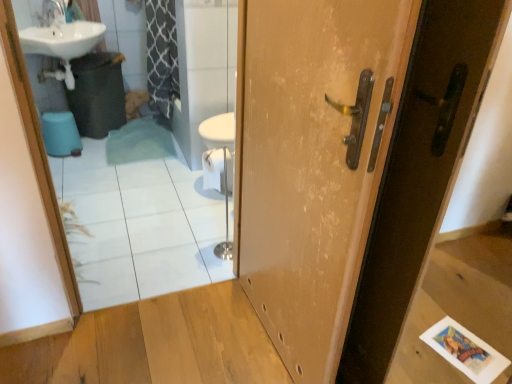
Question: Is there a large distance between blue plastic toilet bowl at lower left and white glossy mirror at upper left?

Choices:
 (A) yes
 (B) no

Answer: (B)

Question: Would you say white glossy mirror at upper left is part of blue plastic toilet bowl at lower left's contents?

Choices:
 (A) no
 (B) yes

Answer: (A)

Question: Does blue plastic toilet bowl at lower left have a greater width compared to white glossy mirror at upper left?

Choices:
 (A) no
 (B) yes

Answer: (B)

Question: Is blue plastic toilet bowl at lower left smaller than white glossy mirror at upper left?

Choices:
 (A) yes
 (B) no

Answer: (A)

Question: From the image's perspective, is blue plastic toilet bowl at lower left on white glossy mirror at upper left?

Choices:
 (A) no
 (B) yes

Answer: (B)

Question: Is blue plastic toilet bowl at lower left behind white glossy mirror at upper left?

Choices:
 (A) yes
 (B) no

Answer: (A)

Question: Considering the relative positions of white glossy mirror at upper left and blue plastic toilet bowl at lower left in the image provided, is white glossy mirror at upper left to the left of blue plastic toilet bowl at lower left from the viewer's perspective?

Choices:
 (A) no
 (B) yes

Answer: (A)

Question: Considering the relative sizes of white glossy mirror at upper left and blue plastic toilet bowl at lower left in the image provided, is white glossy mirror at upper left smaller than blue plastic toilet bowl at lower left?

Choices:
 (A) no
 (B) yes

Answer: (A)

Question: Can you confirm if white glossy mirror at upper left is bigger than blue plastic toilet bowl at lower left?

Choices:
 (A) no
 (B) yes

Answer: (B)

Question: Can you confirm if white glossy mirror at upper left is shorter than blue plastic toilet bowl at lower left?

Choices:
 (A) no
 (B) yes

Answer: (A)

Question: Considering the relative sizes of white glossy mirror at upper left and blue plastic toilet bowl at lower left in the image provided, is white glossy mirror at upper left taller than blue plastic toilet bowl at lower left?

Choices:
 (A) yes
 (B) no

Answer: (A)

Question: Is the surface of white glossy mirror at upper left in direct contact with blue plastic toilet bowl at lower left?

Choices:
 (A) no
 (B) yes

Answer: (A)

Question: Is wooden door at center directly adjacent to blue plastic toilet bowl at lower left?

Choices:
 (A) yes
 (B) no

Answer: (B)